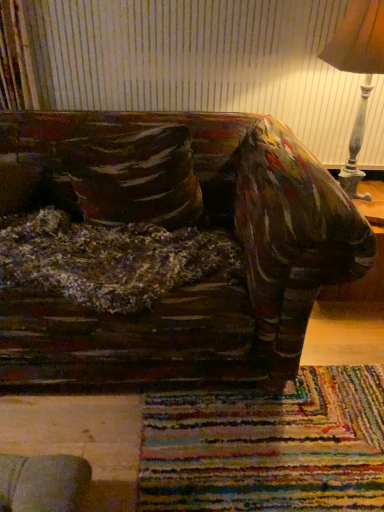
Question: Does point (340, 172) appear closer or farther from the camera than point (140, 164)?

Choices:
 (A) farther
 (B) closer

Answer: (A)

Question: From a real-world perspective, is wooden lampshade at upper right above or below velvety brown pillow at left?

Choices:
 (A) below
 (B) above

Answer: (B)

Question: Is wooden lampshade at upper right taller or shorter than velvety brown pillow at left?

Choices:
 (A) short
 (B) tall

Answer: (B)

Question: Based on their sizes in the image, would you say velvety brown pillow at left is bigger or smaller than wooden lampshade at upper right?

Choices:
 (A) small
 (B) big

Answer: (A)

Question: From a real-world perspective, relative to wooden lampshade at upper right, is velvety brown pillow at left vertically above or below?

Choices:
 (A) below
 (B) above

Answer: (A)

Question: Considering the relative positions of velvety brown pillow at left and wooden lampshade at upper right in the image provided, is velvety brown pillow at left to the left or to the right of wooden lampshade at upper right?

Choices:
 (A) right
 (B) left

Answer: (B)

Question: Does point (104, 196) appear closer or farther from the camera than point (372, 62)?

Choices:
 (A) farther
 (B) closer

Answer: (A)